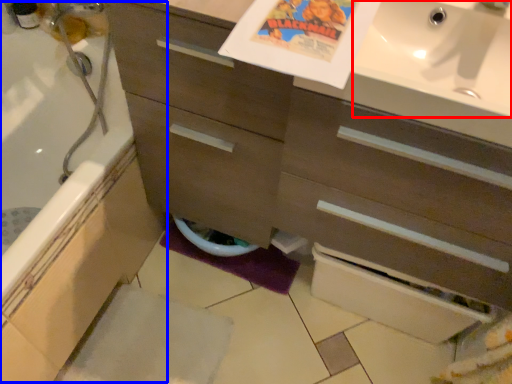
Question: Which object is further to the camera taking this photo, sink (highlighted by a red box) or bath (highlighted by a blue box)?

Choices:
 (A) sink
 (B) bath

Answer: (B)